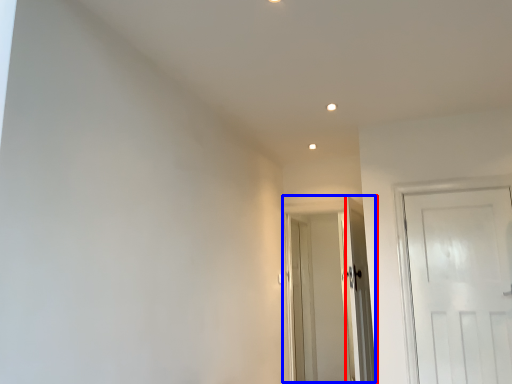
Question: Which object appears closest to the camera in this image, door (highlighted by a red box) or door (highlighted by a blue box)?

Choices:
 (A) door
 (B) door

Answer: (A)